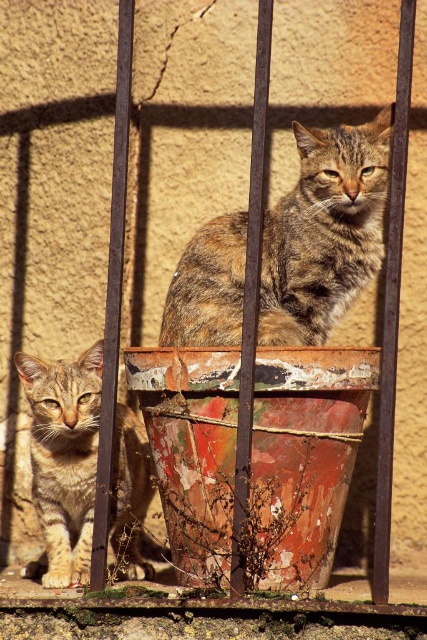
Is tabby fur cat at center smaller than tabby fur cat at left?

Indeed, tabby fur cat at center has a smaller size compared to tabby fur cat at left.

Who is more distant from viewer, [218,236] or [136,493]?

Point [136,493]

I want to click on tabby fur cat at center, so click(x=324, y=230).

This screenshot has height=640, width=427. I want to click on tabby fur cat at center, so click(324, 230).